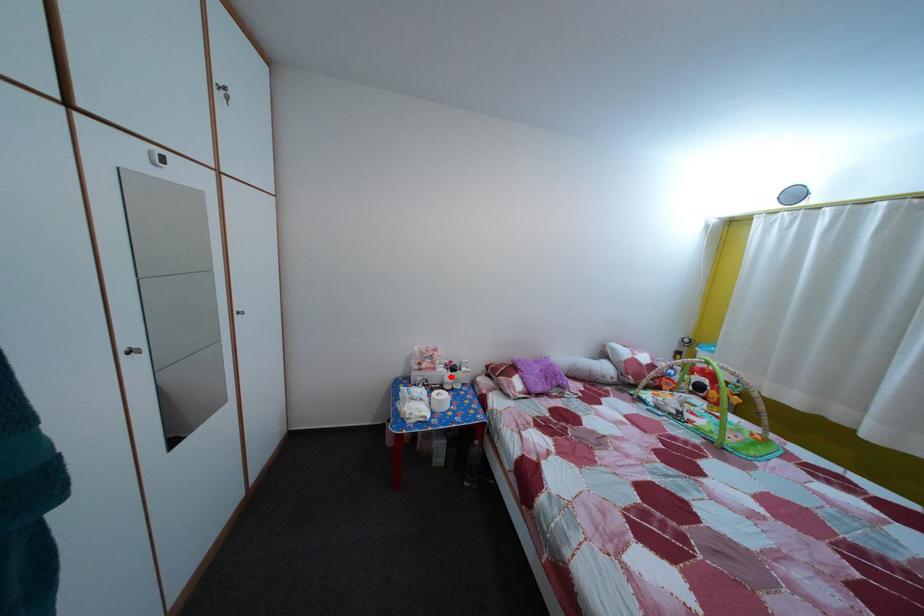
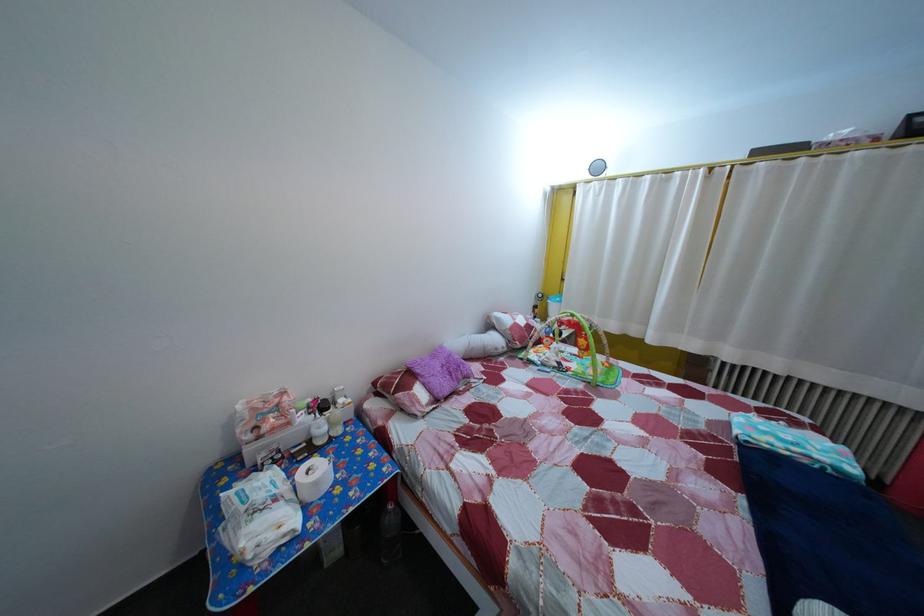
In the second image, find the point that corresponds to the highlighted location in the first image.

(311, 427)